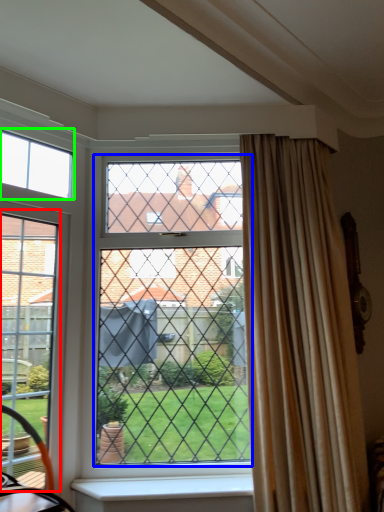
Question: Considering the real-world distances, which object is farthest from screen door (highlighted by a red box)? glass window (highlighted by a blue box) or window (highlighted by a green box)?

Choices:
 (A) glass window
 (B) window

Answer: (A)